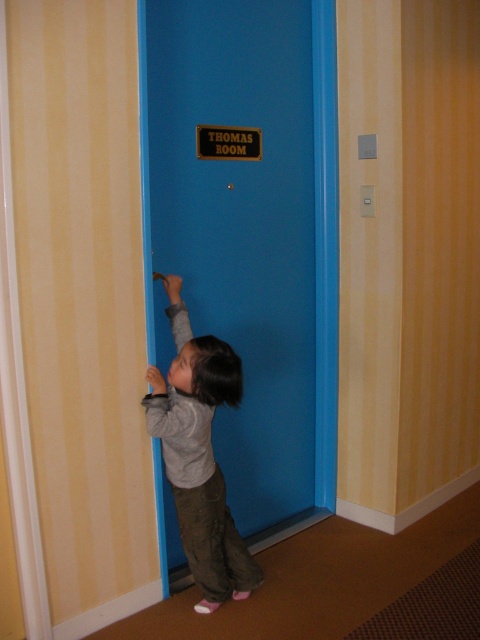
Question: Does blue matte door at center have a smaller size compared to gray cotton shirt at center?

Choices:
 (A) no
 (B) yes

Answer: (A)

Question: Which point appears farthest from the camera in this image?

Choices:
 (A) (154, 154)
 (B) (204, 528)

Answer: (A)

Question: Is blue matte door at center to the left of gray cotton shirt at center from the viewer's perspective?

Choices:
 (A) no
 (B) yes

Answer: (A)

Question: From the image, what is the correct spatial relationship of blue matte door at center in relation to gray cotton shirt at center?

Choices:
 (A) left
 (B) right

Answer: (B)